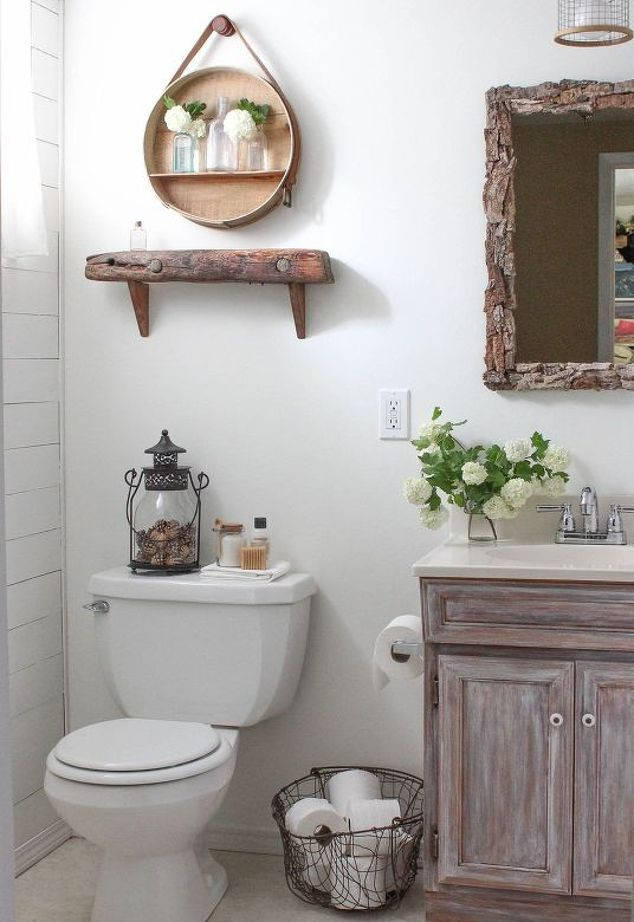
Where is `toilet paper`? Image resolution: width=634 pixels, height=922 pixels. toilet paper is located at coordinates (356, 790), (371, 814), (333, 819), (385, 667).